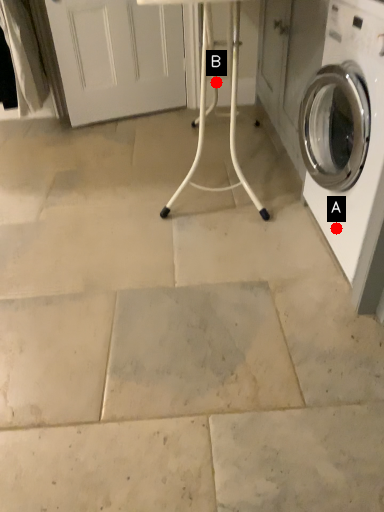
Question: Two points are circled on the image, labeled by A and B beside each circle. Which point is closer to the camera?

Choices:
 (A) A is closer
 (B) B is closer

Answer: (A)